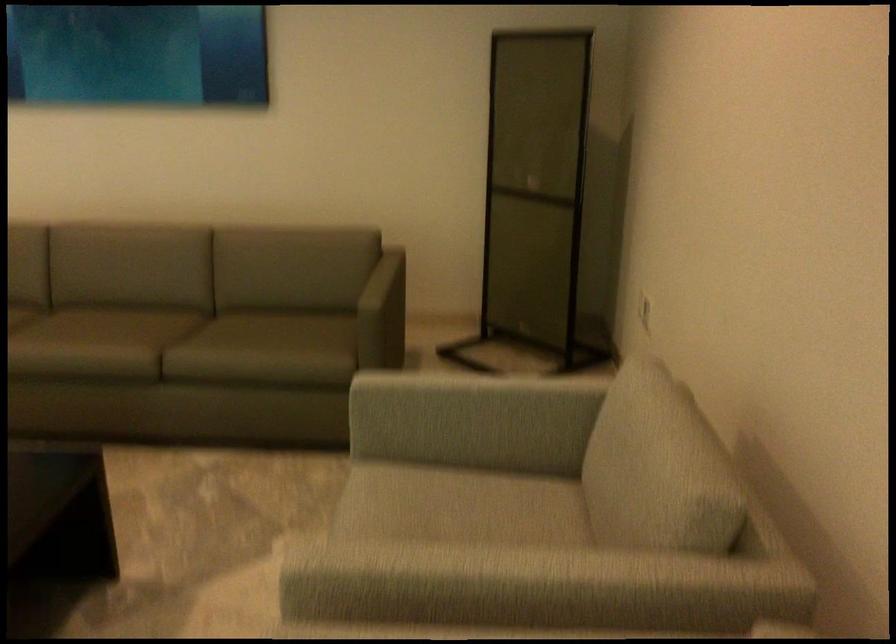
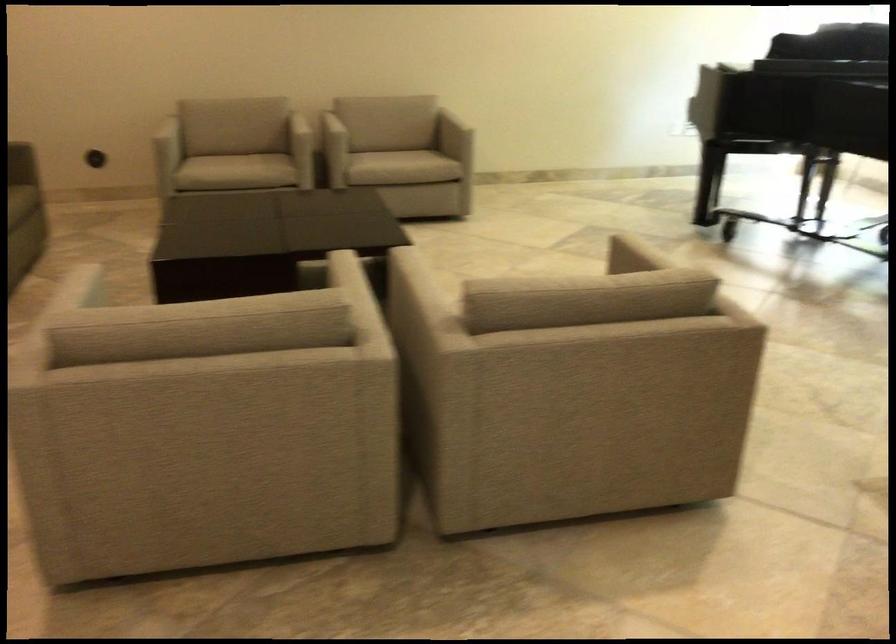
Find the pixel in the second image that matches the point at 653,451 in the first image.

(245, 98)